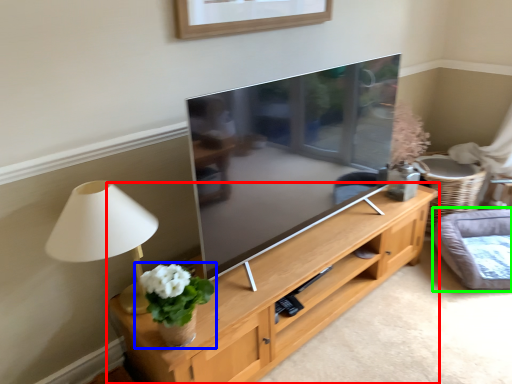
Question: Which is nearer to the shelf (highlighted by a red box)? houseplant (highlighted by a blue box) or cat bed (highlighted by a green box).

Choices:
 (A) houseplant
 (B) cat bed

Answer: (A)